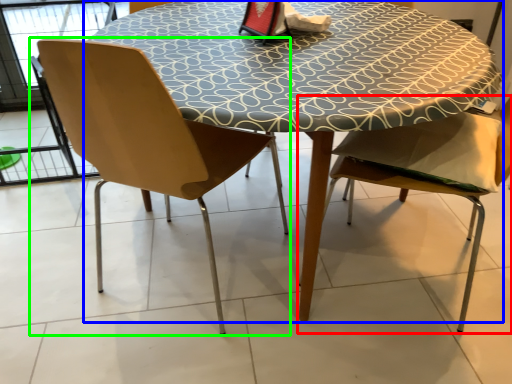
Question: Estimate the real-world distances between objects in this image. Which object is closer to chair (highlighted by a red box), table (highlighted by a blue box) or chair (highlighted by a green box)?

Choices:
 (A) table
 (B) chair

Answer: (A)